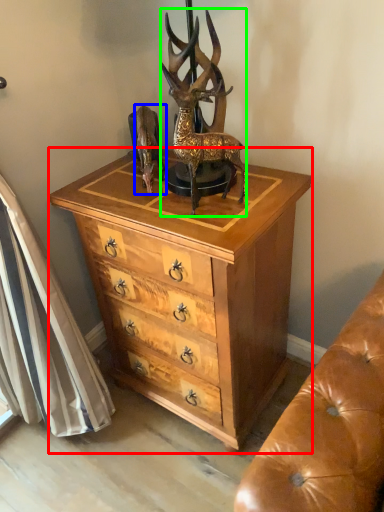
Question: Which object is the closest to the chest of drawers (highlighted by a red box)? Choose among these: animal (highlighted by a blue box) or deer (highlighted by a green box).

Choices:
 (A) animal
 (B) deer

Answer: (B)